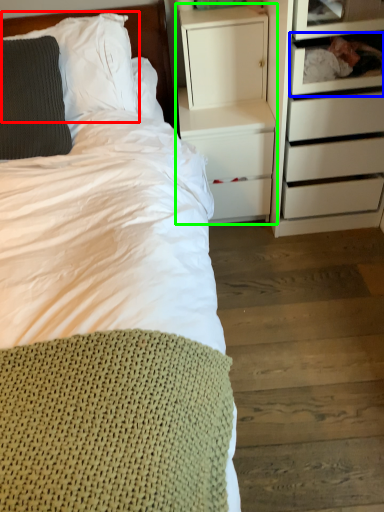
Question: Based on their relative distances, which object is farther from pillow (highlighted by a red box)? Choose from shelf (highlighted by a blue box) and nightstand (highlighted by a green box).

Choices:
 (A) shelf
 (B) nightstand

Answer: (A)